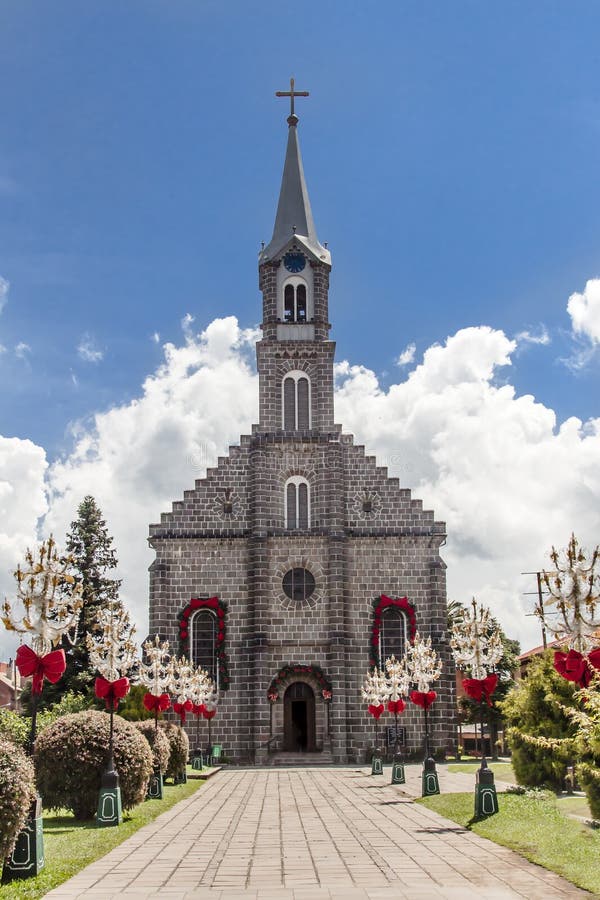
The image size is (600, 900). In order to click on door in this screenshot , I will do `click(300, 723)`.